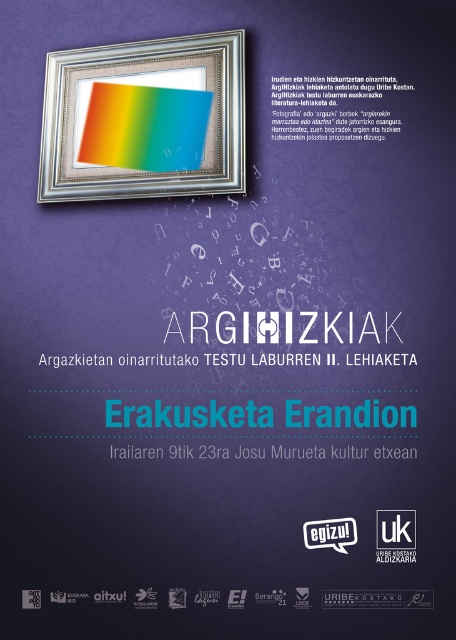
Can you confirm if silver metallic picture frame at upper center is thinner than rainbow paper at upper center?

No, silver metallic picture frame at upper center is not thinner than rainbow paper at upper center.

Can you confirm if silver metallic picture frame at upper center is positioned to the left of rainbow paper at upper center?

Yes, silver metallic picture frame at upper center is to the left of rainbow paper at upper center.

Find the location of a particular element. This screenshot has height=640, width=456. silver metallic picture frame at upper center is located at coordinates (145, 120).